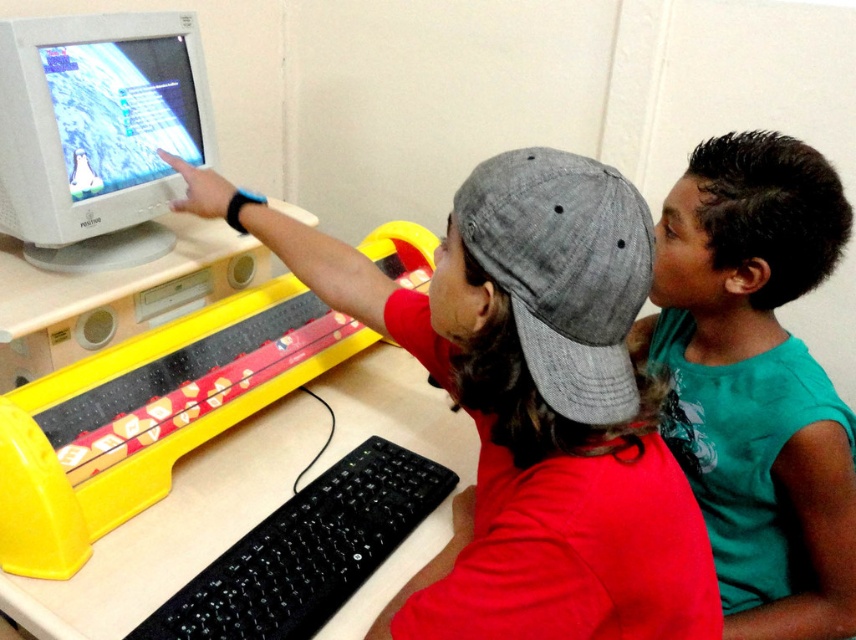
You are a photographer trying to capture a closeup shot of the yellow plastic video game at left while also including the green matte shirt at right in the frame. Based on their sizes, which object should you focus on first to ensure both are in focus?

The green matte shirt at right is smaller than the yellow plastic video game at left, so you should focus on the yellow plastic video game at left first since larger objects require more precise focusing to ensure sharpness, while smaller objects like the green matte shirt at right will naturally fall into focus if the main subject is properly focused.

You are a delivery person who just arrived at the workstation. You need to place the yellow plastic video game at left and the white glossy computer monitor at upper left onto a shelf that can only hold items stacked vertically. Can both items fit vertically if the shelf has a height limit of 50 cm?

The yellow plastic video game at left is below the white glossy computer monitor at upper left, indicating it is shorter in height. Since the shelf has a 50 cm height limit, both items can be stacked vertically as long as their combined heights do not exceed 50 cm. However, without knowing the exact dimensions of each item, we cannot confirm if they fit together. Please measure both items to ensure their total height is within the limit.